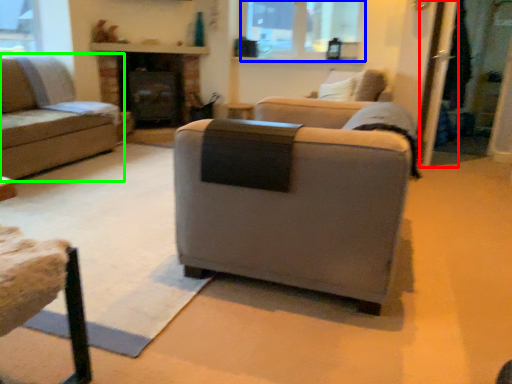
Question: Which object is the closest to the screen door (highlighted by a red box)? Choose among these: bay window (highlighted by a blue box) or studio couch (highlighted by a green box).

Choices:
 (A) bay window
 (B) studio couch

Answer: (A)